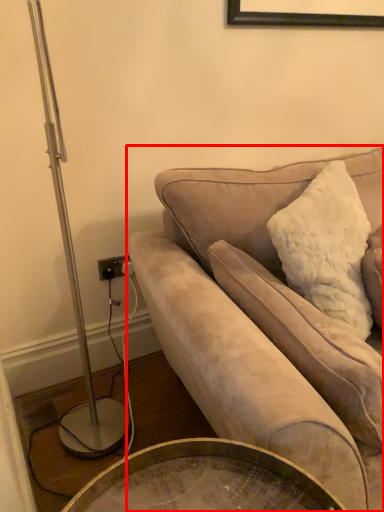
Question: From the image's perspective, where is studio couch (annotated by the red box) located in relation to pillow in the image?

Choices:
 (A) below
 (B) above

Answer: (B)